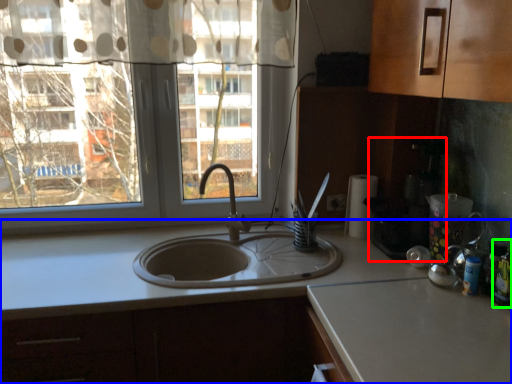
Question: Based on their relative distances, which object is nearer to coffee machine (highlighted by a red box)? Choose from countertop (highlighted by a blue box) and bottle (highlighted by a green box).

Choices:
 (A) countertop
 (B) bottle

Answer: (B)